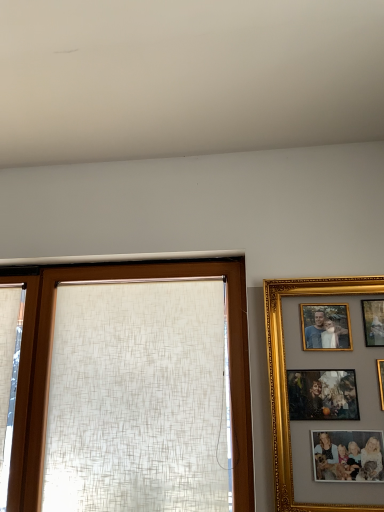
Question: Can you confirm if white textured curtain at left is positioned to the right of gold/gilded picture frame at right?

Choices:
 (A) no
 (B) yes

Answer: (A)

Question: Is white textured curtain at left far away from gold/gilded picture frame at right?

Choices:
 (A) yes
 (B) no

Answer: (A)

Question: From a real-world perspective, is white textured curtain at left below gold/gilded picture frame at right?

Choices:
 (A) yes
 (B) no

Answer: (B)

Question: Does white textured curtain at left appear on the left side of gold/gilded picture frame at right?

Choices:
 (A) yes
 (B) no

Answer: (A)

Question: Is white textured curtain at left facing away from gold/gilded picture frame at right?

Choices:
 (A) yes
 (B) no

Answer: (B)

Question: Could you tell me if white textured curtain at left is facing gold/gilded picture frame at right?

Choices:
 (A) no
 (B) yes

Answer: (A)

Question: Is gold/gilded picture frame at right touching matte beige curtain at center?

Choices:
 (A) yes
 (B) no

Answer: (B)

Question: Considering the relative positions of gold/gilded picture frame at right and matte beige curtain at center in the image provided, is gold/gilded picture frame at right behind matte beige curtain at center?

Choices:
 (A) yes
 (B) no

Answer: (B)

Question: Does gold/gilded picture frame at right appear on the right side of matte beige curtain at center?

Choices:
 (A) no
 (B) yes

Answer: (B)

Question: Is gold/gilded picture frame at right at the left side of matte beige curtain at center?

Choices:
 (A) yes
 (B) no

Answer: (B)

Question: Does gold/gilded picture frame at right contain matte beige curtain at center?

Choices:
 (A) no
 (B) yes

Answer: (A)

Question: Could you tell me if gold/gilded picture frame at right is turned towards matte beige curtain at center?

Choices:
 (A) no
 (B) yes

Answer: (A)

Question: Can you confirm if white textured curtain at left is thinner than matte beige curtain at center?

Choices:
 (A) no
 (B) yes

Answer: (B)